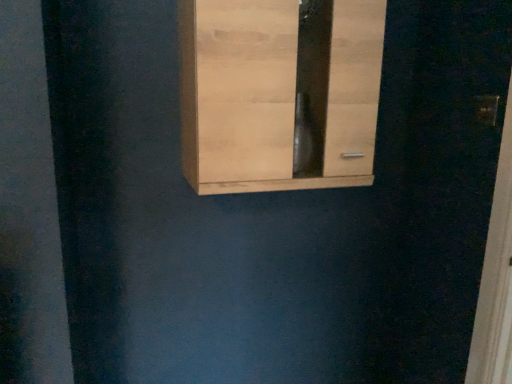
Question: Should I look upward or downward to see natural wood cupboard at upper center?

Choices:
 (A) up
 (B) down

Answer: (A)